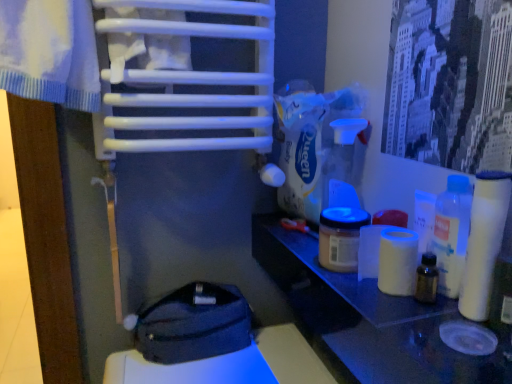
Question: Does white matte toilet paper at right, the first toilet paper viewed from the back, lie in front of matte plastic jar at center?

Choices:
 (A) yes
 (B) no

Answer: (A)

Question: Is white matte toilet paper at right, which appears as the 1th toilet paper when viewed from the left, not inside matte plastic jar at center?

Choices:
 (A) no
 (B) yes

Answer: (B)

Question: Is white matte toilet paper at right, which ranks as the 2th toilet paper in right-to-left order, far away from matte plastic jar at center?

Choices:
 (A) no
 (B) yes

Answer: (A)

Question: Can you confirm if white matte toilet paper at right, the first toilet paper viewed from the back, is positioned to the right of matte plastic jar at center?

Choices:
 (A) no
 (B) yes

Answer: (B)

Question: From the image's perspective, would you say white matte toilet paper at right, which ranks as the 2th toilet paper in right-to-left order, is positioned over matte plastic jar at center?

Choices:
 (A) no
 (B) yes

Answer: (A)

Question: Does white matte toilet paper at right, which ranks as the 2th toilet paper in right-to-left order, turn towards matte plastic jar at center?

Choices:
 (A) yes
 (B) no

Answer: (B)

Question: From a real-world perspective, is matte plastic jar at center below white glossy table at right?

Choices:
 (A) no
 (B) yes

Answer: (A)

Question: Does matte plastic jar at center have a smaller size compared to white glossy table at right?

Choices:
 (A) no
 (B) yes

Answer: (B)

Question: Is the position of matte plastic jar at center less distant than that of white glossy table at right?

Choices:
 (A) no
 (B) yes

Answer: (A)

Question: Is matte plastic jar at center next to white glossy table at right and touching it?

Choices:
 (A) yes
 (B) no

Answer: (B)

Question: Is matte plastic jar at center taller than white glossy table at right?

Choices:
 (A) no
 (B) yes

Answer: (B)

Question: Does matte plastic jar at center have a lesser width compared to white glossy table at right?

Choices:
 (A) yes
 (B) no

Answer: (A)

Question: From a real-world perspective, is dark gray fabric pouch at lower center positioned over white matte toilet paper at right, which ranks as the 1th toilet paper in right-to-left order, based on gravity?

Choices:
 (A) no
 (B) yes

Answer: (A)